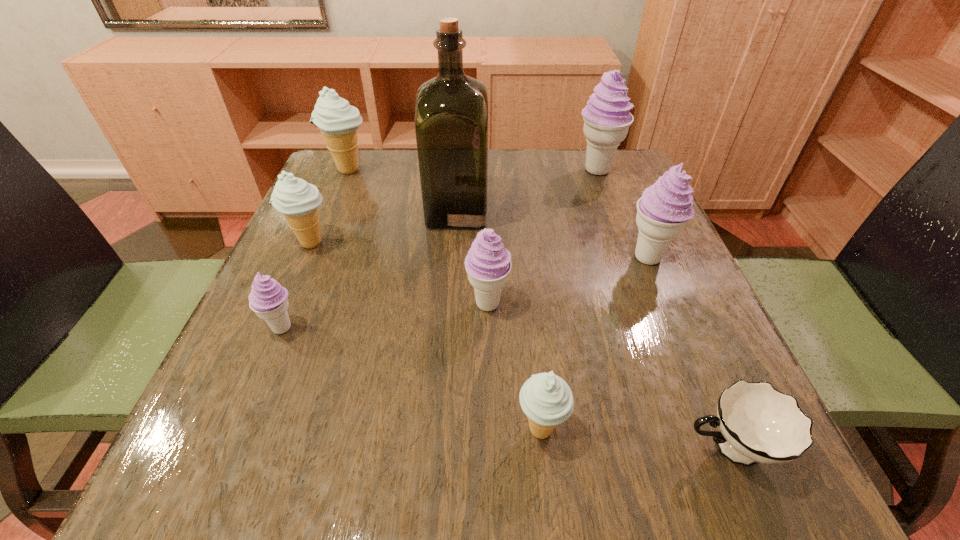
Locate an element on the screen. The height and width of the screenshot is (540, 960). vacant space situated on the side of the white cup with the handle is located at coordinates (600, 448).

Locate an element on the screen. blank space located 0.070m on the side of the white cup with the handle is located at coordinates (629, 448).

The image size is (960, 540). In order to click on blank space located on the side of the white cup with the handle in this screenshot , I will do `click(557, 448)`.

This screenshot has width=960, height=540. I want to click on liquor at the far edge, so click(451, 111).

Image resolution: width=960 pixels, height=540 pixels. I want to click on icecream that is at the near edge, so click(546, 399).

This screenshot has height=540, width=960. What are the coordinates of `cup present at the near edge` in the screenshot? It's located at (758, 424).

Where is `cup that is positioned at the right edge`? cup that is positioned at the right edge is located at coordinates (758, 424).

This screenshot has height=540, width=960. In order to click on object present at the far left corner in this screenshot , I will do `click(338, 121)`.

What are the coordinates of `object positioned at the far right corner` in the screenshot? It's located at (607, 118).

At what (x,y) coordinates should I click in order to perform the action: click on object that is at the near right corner. Please return your answer as a coordinate pair (x, y). The image size is (960, 540). Looking at the image, I should click on (758, 424).